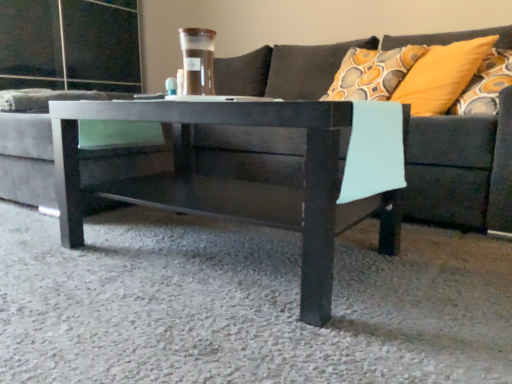
Question: From a real-world perspective, does yellow fabric pillow at upper right sit lower than dark gray fabric couch at center?

Choices:
 (A) yes
 (B) no

Answer: (B)

Question: Considering the relative sizes of yellow fabric pillow at upper right and dark gray fabric couch at center in the image provided, is yellow fabric pillow at upper right bigger than dark gray fabric couch at center?

Choices:
 (A) yes
 (B) no

Answer: (B)

Question: Is yellow fabric pillow at upper right next to dark gray fabric couch at center?

Choices:
 (A) yes
 (B) no

Answer: (B)

Question: Is yellow fabric pillow at upper right in front of dark gray fabric couch at center?

Choices:
 (A) no
 (B) yes

Answer: (A)

Question: Does yellow fabric pillow at upper right have a smaller size compared to dark gray fabric couch at center?

Choices:
 (A) yes
 (B) no

Answer: (A)

Question: Is dark gray fabric couch at center completely or partially inside yellow fabric pillow at upper right?

Choices:
 (A) yes
 (B) no

Answer: (B)

Question: From the image's perspective, does matte black coffee table at center appear higher than dark gray fabric couch at center?

Choices:
 (A) no
 (B) yes

Answer: (A)

Question: Could you tell me if matte black coffee table at center is facing dark gray fabric couch at center?

Choices:
 (A) no
 (B) yes

Answer: (B)

Question: Does matte black coffee table at center appear on the left side of dark gray fabric couch at center?

Choices:
 (A) yes
 (B) no

Answer: (A)

Question: Is matte black coffee table at center positioned far away from dark gray fabric couch at center?

Choices:
 (A) no
 (B) yes

Answer: (B)

Question: Does matte black coffee table at center touch dark gray fabric couch at center?

Choices:
 (A) no
 (B) yes

Answer: (A)

Question: Is matte black coffee table at center completely or partially outside of dark gray fabric couch at center?

Choices:
 (A) no
 (B) yes

Answer: (A)

Question: From a real-world perspective, is yellow fabric pillow at upper right over matte black coffee table at center?

Choices:
 (A) no
 (B) yes

Answer: (B)